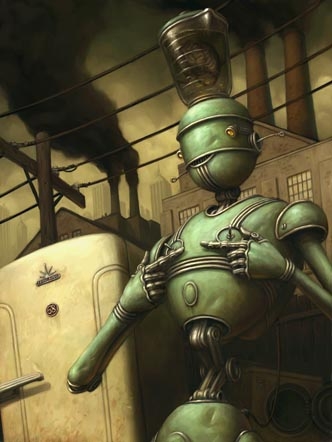
Locate all where you open a refrigerator in the image. Your answer should be formatted as a list of tuples, i.e. [(x1, y1), (x2, y2), ...], where each tuple contains the x and y coordinates of a point satisfying the conditions above.

[(13, 384)]